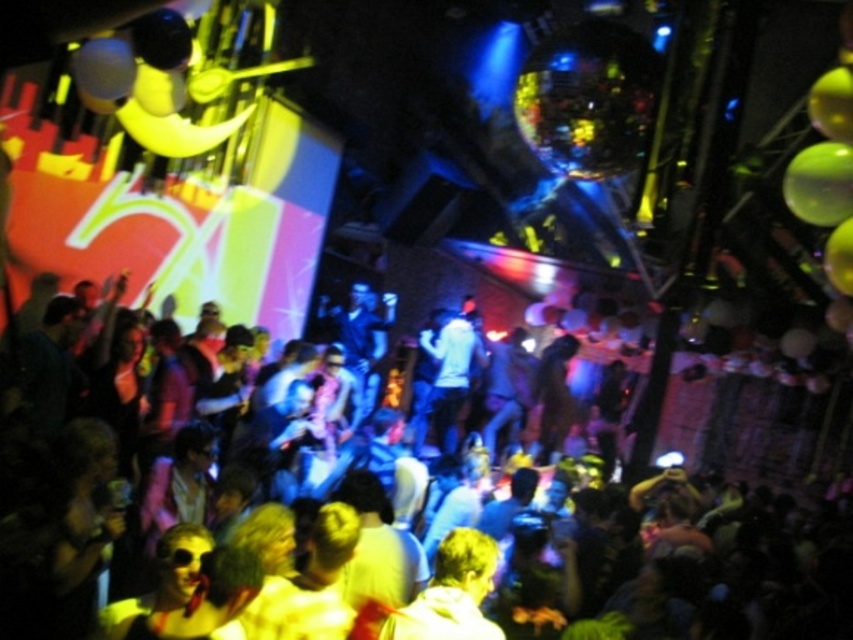
Looking at this image, you are standing in the nightclub and want to reach the point marked at coordinates point (456,417). Given that the average walking distance for an adult is about 0.75 meters per step, how many steps would it take you to reach that point?

The point (456,417) is 9.18 meters away from the viewer. Since each step covers approximately 0.75 meters, dividing 9.18 by 0.75 gives approximately 12.24 steps. Therefore, it would take around 12 steps to reach the point.

You are a photographer trying to capture a clear shot of both the shiny plastic balloons at center and the white matte shirt at center. Since you want both subjects in focus, which one should you adjust your camera focus to prioritize first?

The shiny plastic balloons at center is closer to the viewer than the white matte shirt at center, so you should focus on the balloons first to ensure both are in focus.